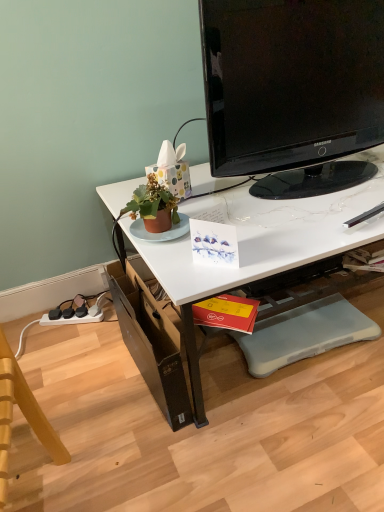
Identify the location of vacant space situated above red matte book at lower center (from a real-world perspective). (228, 308).